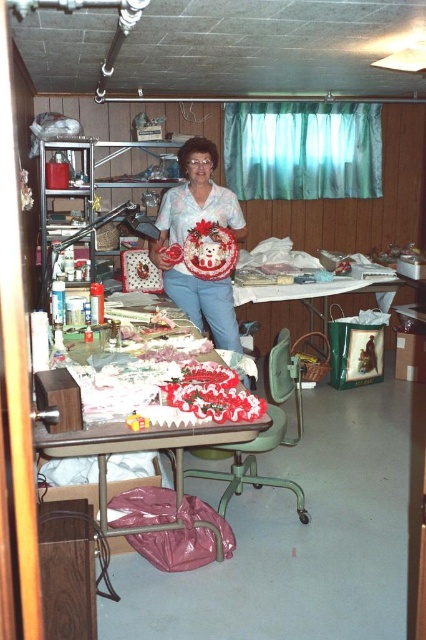
Question: Can you confirm if matte white fabric at center is positioned below metallic silver table at center?

Choices:
 (A) no
 (B) yes

Answer: (A)

Question: Which object is positioned closest to the matte white fabric at center?

Choices:
 (A) metallic silver table at center
 (B) wooden table at center

Answer: (B)

Question: Can you confirm if matte white fabric at center is thinner than metallic silver table at center?

Choices:
 (A) no
 (B) yes

Answer: (B)

Question: Which of these objects is positioned closest to the matte white fabric at center?

Choices:
 (A) wooden table at center
 (B) metallic silver table at center

Answer: (A)

Question: Is wooden table at center bigger than metallic silver table at center?

Choices:
 (A) no
 (B) yes

Answer: (B)

Question: Which point appears farthest from the camera in this image?

Choices:
 (A) (158, 225)
 (B) (143, 532)
 (C) (363, 285)

Answer: (C)